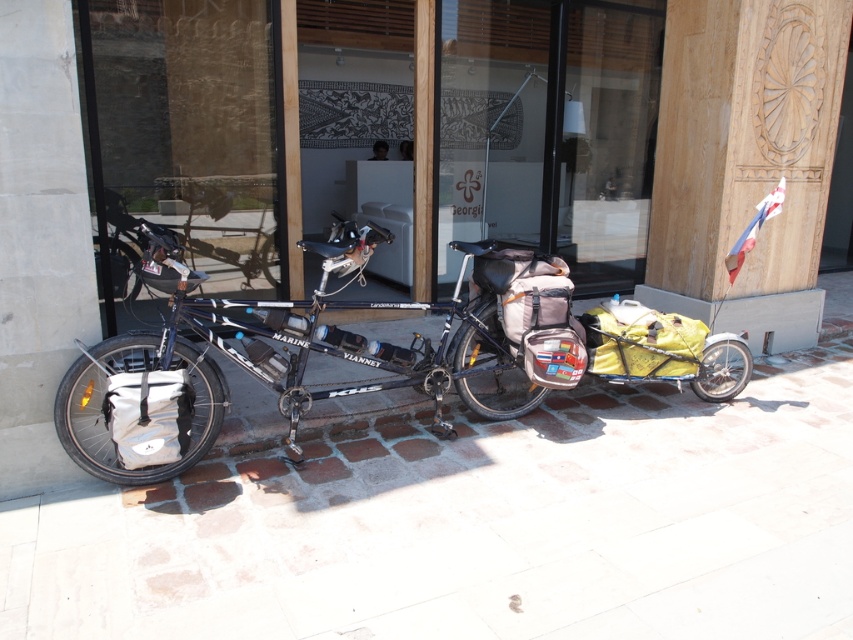
Which of these two, white stone pavement at lower center or matte black bicycle at center, stands taller?

matte black bicycle at center

What do you see at coordinates (479, 524) in the screenshot?
I see `white stone pavement at lower center` at bounding box center [479, 524].

Who is more distant from viewer, (175,552) or (177,401)?

The point (177,401) is behind.

This screenshot has height=640, width=853. What are the coordinates of `white stone pavement at lower center` in the screenshot? It's located at (479, 524).

Which is more to the right, white stone pavement at lower center or concrete at left?

Positioned to the right is white stone pavement at lower center.

Does white stone pavement at lower center appear under concrete at left?

Yes, white stone pavement at lower center is below concrete at left.

The height and width of the screenshot is (640, 853). What do you see at coordinates (479, 524) in the screenshot? I see `white stone pavement at lower center` at bounding box center [479, 524].

Where is `white stone pavement at lower center`? The width and height of the screenshot is (853, 640). white stone pavement at lower center is located at coordinates (479, 524).

Between point (140, 346) and point (22, 212), which one is positioned in front?

Positioned in front is point (22, 212).

Can you confirm if matte black bicycle at center is positioned below concrete at left?

Correct, matte black bicycle at center is located below concrete at left.

At what (x,y) coordinates should I click in order to perform the action: click on matte black bicycle at center. Please return your answer as a coordinate pair (x, y). Looking at the image, I should click on (283, 364).

Find the location of a particular element. The image size is (853, 640). matte black bicycle at center is located at coordinates (283, 364).